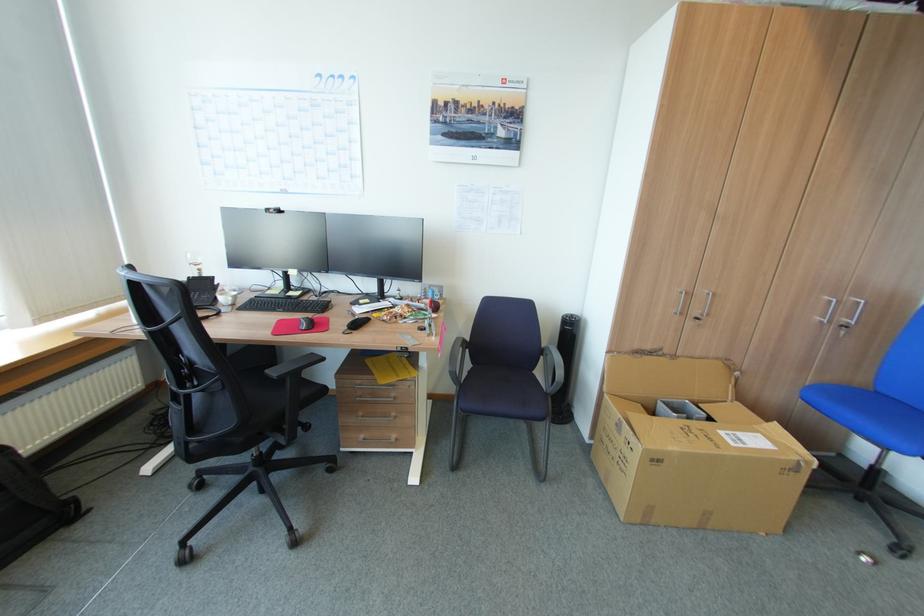
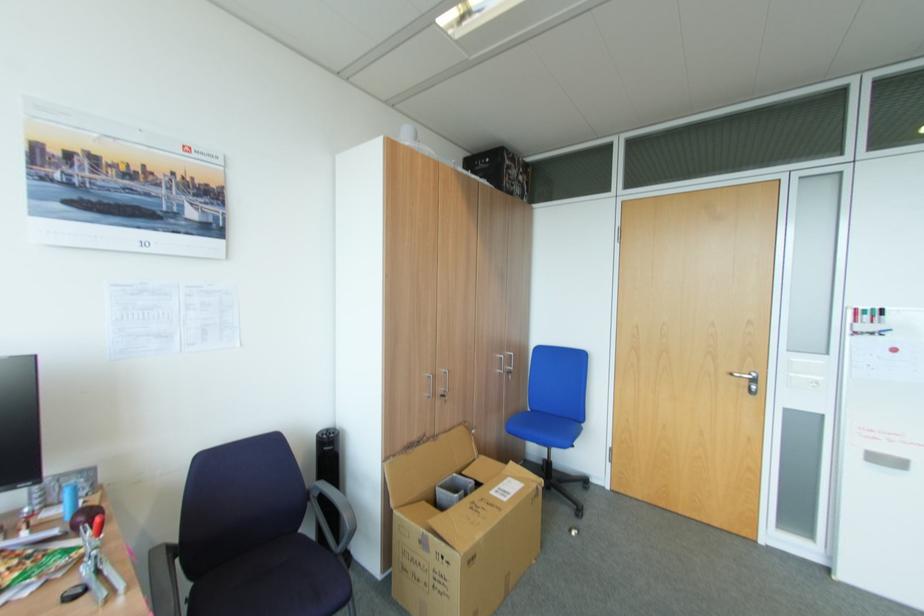
Where in the second image is the point corresponding to pixel 469 339 from the first image?

(174, 546)